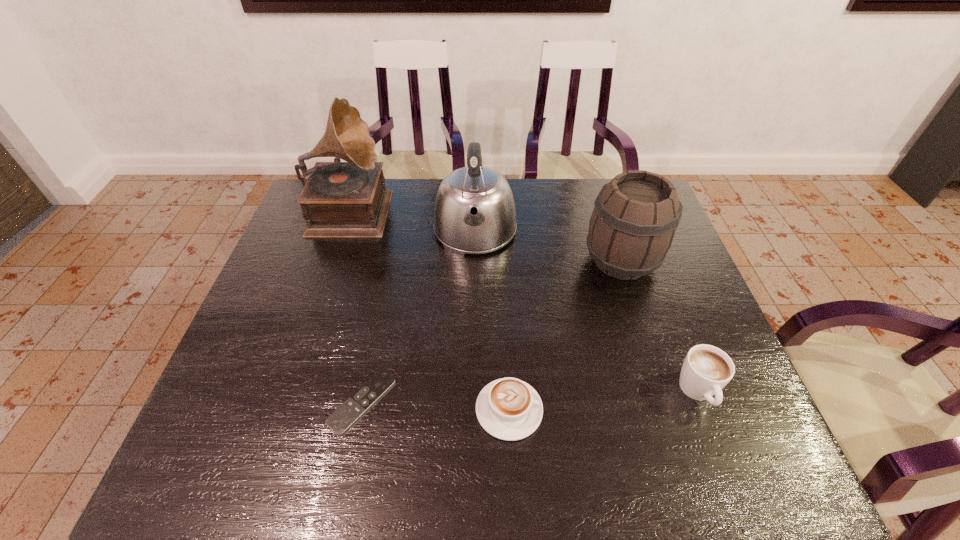
This screenshot has height=540, width=960. I want to click on free spot that satisfies the following two spatial constraints: 1. from the horn of the record player; 2. on the right side of the remote control, so click(286, 402).